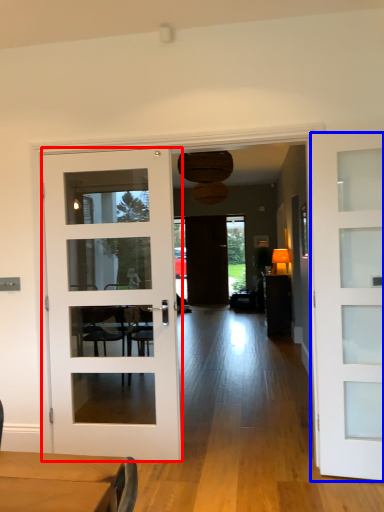
Question: Among these objects, which one is nearest to the camera, door (highlighted by a red box) or door (highlighted by a blue box)?

Choices:
 (A) door
 (B) door

Answer: (B)